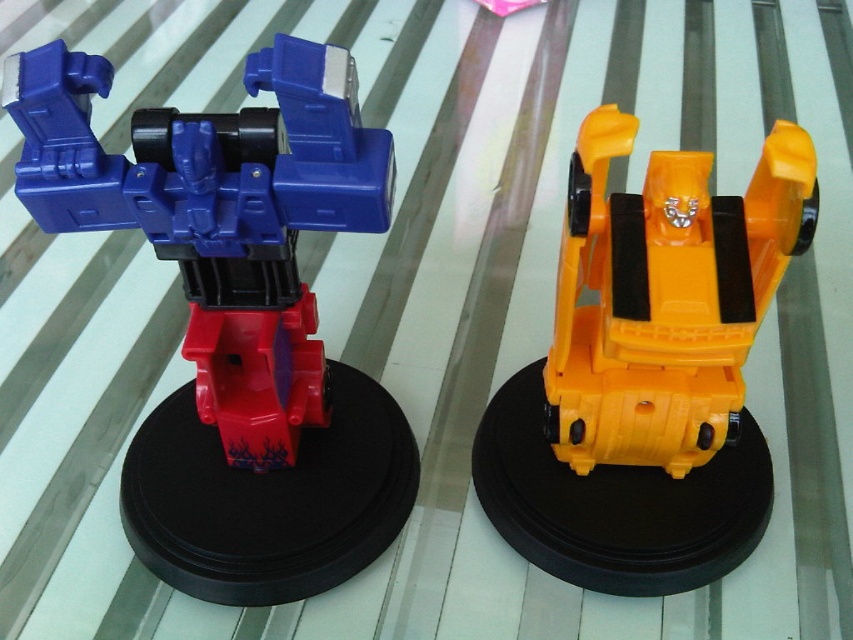
What do you see at coordinates (647, 371) in the screenshot?
I see `orange matte plastic robot at center` at bounding box center [647, 371].

Measure the distance from orange matte plastic robot at center to matte plastic transformer at left.

11.63 inches

In the scene shown: Who is more forward, (x=767, y=259) or (x=265, y=394)?

Positioned in front is point (x=767, y=259).

Locate an element on the screen. orange matte plastic robot at center is located at coordinates (647, 371).